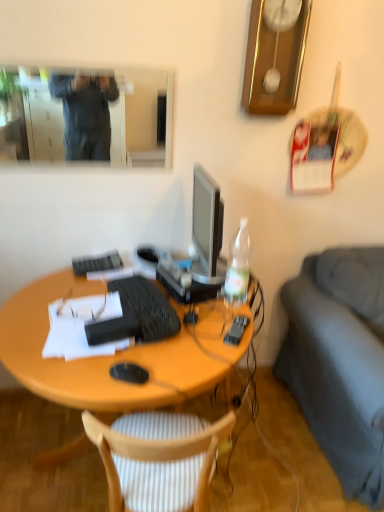
Find the location of a particular element. The width and height of the screenshot is (384, 512). free space in front of black matte keyboard at center, which is the first computer keyboard from front to back is located at coordinates (135, 365).